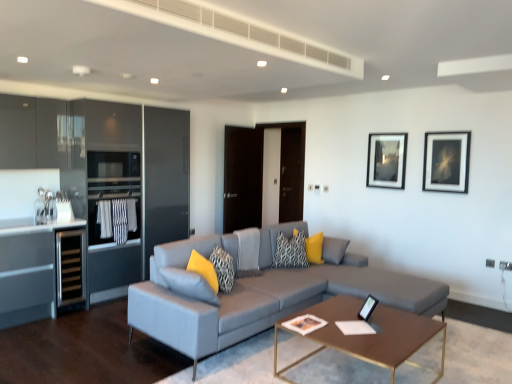
Question: Is matte black picture frame at upper right, which is the first picture frame from right to left, outside of textured gray pillow at center, the second pillow from the left?

Choices:
 (A) no
 (B) yes

Answer: (B)

Question: Is matte black picture frame at upper right, which ranks as the second picture frame in left-to-right order, surrounding textured gray pillow at center, positioned as the 2th pillow in front-to-back order?

Choices:
 (A) no
 (B) yes

Answer: (A)

Question: Is matte black picture frame at upper right, which ranks as the second picture frame in left-to-right order, taller than textured gray pillow at center, which ranks as the 3th pillow in back-to-front order?

Choices:
 (A) no
 (B) yes

Answer: (B)

Question: Does matte black picture frame at upper right, which is the first picture frame from right to left, turn towards textured gray pillow at center, positioned as the 2th pillow in front-to-back order?

Choices:
 (A) yes
 (B) no

Answer: (A)

Question: Is matte black picture frame at upper right, positioned as the first picture frame in front-to-back order, beside textured gray pillow at center, the second pillow from the left?

Choices:
 (A) yes
 (B) no

Answer: (B)

Question: From a real-world perspective, is yellow fabric pillow at center, arranged as the fourth pillow when viewed from the left, above or below transparent glass door at center?

Choices:
 (A) above
 (B) below

Answer: (B)

Question: Considering the relative positions of yellow fabric pillow at center, the fourth pillow positioned from the front, and transparent glass door at center in the image provided, is yellow fabric pillow at center, the fourth pillow positioned from the front, to the left or to the right of transparent glass door at center?

Choices:
 (A) left
 (B) right

Answer: (B)

Question: Is yellow fabric pillow at center, the 1th pillow positioned from the right, situated inside transparent glass door at center or outside?

Choices:
 (A) inside
 (B) outside

Answer: (B)

Question: Is yellow fabric pillow at center, the 1th pillow positioned from the right, wider or thinner than transparent glass door at center?

Choices:
 (A) thin
 (B) wide

Answer: (A)

Question: From a real-world perspective, is textured gray pillow at center, the second pillow from the left, physically located above or below matte black picture frame at upper center, which appears as the 1th picture frame when viewed from the left?

Choices:
 (A) above
 (B) below

Answer: (B)

Question: Is textured gray pillow at center, positioned as the 2th pillow in front-to-back order, wider or thinner than matte black picture frame at upper center, the 2th picture frame from the right?

Choices:
 (A) thin
 (B) wide

Answer: (B)

Question: Is textured gray pillow at center, positioned as the 2th pillow in front-to-back order, in front of or behind matte black picture frame at upper center, placed as the 2th picture frame when sorted from front to back, in the image?

Choices:
 (A) front
 (B) behind

Answer: (A)

Question: Is point (224, 259) closer or farther from the camera than point (393, 142)?

Choices:
 (A) farther
 (B) closer

Answer: (B)

Question: Is matte black picture frame at upper right, which is the first picture frame from right to left, to the left or to the right of black stainless steel wine cooler at left in the image?

Choices:
 (A) left
 (B) right

Answer: (B)

Question: Considering the positions of matte black picture frame at upper right, positioned as the first picture frame in front-to-back order, and black stainless steel wine cooler at left in the image, is matte black picture frame at upper right, positioned as the first picture frame in front-to-back order, wider or thinner than black stainless steel wine cooler at left?

Choices:
 (A) thin
 (B) wide

Answer: (A)